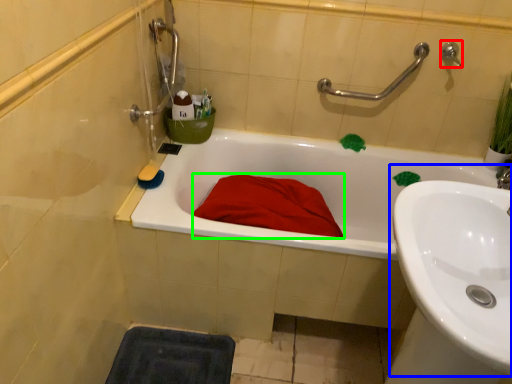
Question: Which object is the farthest from plumbing fixture (highlighted by a red box)? Choose among these: sink (highlighted by a blue box) or blanket (highlighted by a green box).

Choices:
 (A) sink
 (B) blanket

Answer: (A)